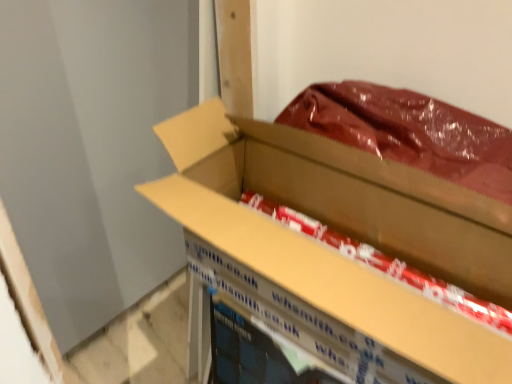
Question: Would you say red glossy paper at center is inside or outside cardboard box at center?

Choices:
 (A) outside
 (B) inside

Answer: (B)

Question: Is red glossy paper at center in front of or behind cardboard box at center in the image?

Choices:
 (A) behind
 (B) front

Answer: (A)

Question: Considering the positions of red glossy paper at center and cardboard box at center in the image, is red glossy paper at center taller or shorter than cardboard box at center?

Choices:
 (A) short
 (B) tall

Answer: (A)

Question: From a real-world perspective, is cardboard box at center positioned above or below red glossy paper at center?

Choices:
 (A) above
 (B) below

Answer: (A)

Question: Which is correct: cardboard box at center is inside red glossy paper at center, or outside of it?

Choices:
 (A) outside
 (B) inside

Answer: (A)

Question: Is point (246, 147) closer or farther from the camera than point (501, 324)?

Choices:
 (A) closer
 (B) farther

Answer: (B)

Question: From the image's perspective, is cardboard box at center above or below red glossy paper at center?

Choices:
 (A) below
 (B) above

Answer: (A)